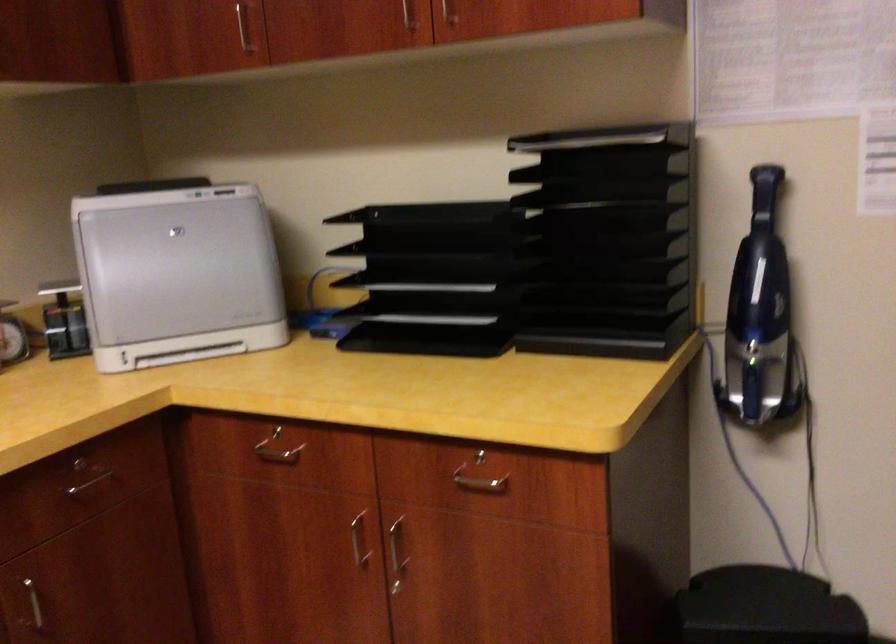
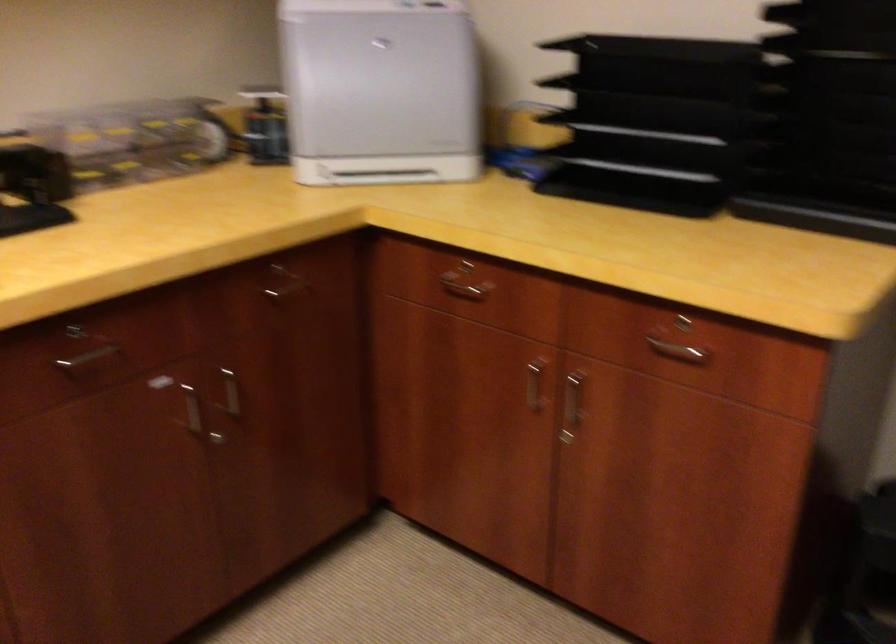
In the second image, find the point that corresponds to point 99,484 in the first image.

(290, 294)